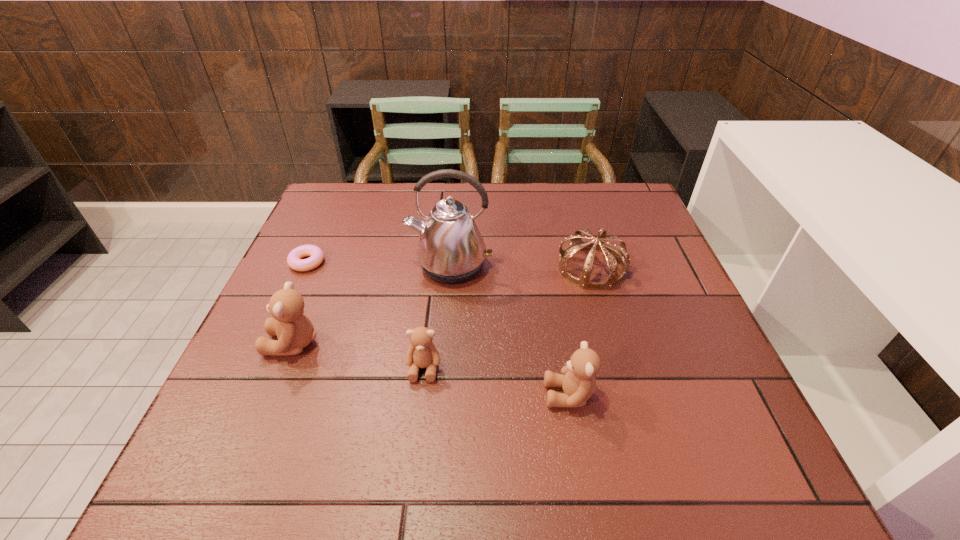
You are a GUI agent. You are given a task and a screenshot of the screen. Output one action in this format:
    pyautogui.click(x=<x>, y=<y>)
    Task: Click on the blank space at the near edge
    This screenshot has width=960, height=540.
    Given the screenshot: What is the action you would take?
    pyautogui.click(x=527, y=417)

In order to click on free space at the left edge in this screenshot , I will do `click(341, 246)`.

At what (x,y) coordinates should I click in order to perform the action: click on free space at the right edge of the desktop. Please return your answer as a coordinate pair (x, y). Image resolution: width=960 pixels, height=540 pixels. Looking at the image, I should click on tap(652, 315).

In the image, there is a desktop. Where is `free region at the far left corner`? free region at the far left corner is located at coordinates (360, 226).

Find the location of `blank space at the far right corner of the desktop`. blank space at the far right corner of the desktop is located at coordinates (631, 208).

Identify the location of free spot between the second shortest teddy bear and the kettle. The width and height of the screenshot is (960, 540). (510, 330).

Find the location of `vacant area between the tallest object and the second shortest teddy bear`. vacant area between the tallest object and the second shortest teddy bear is located at coordinates (510, 330).

The image size is (960, 540). In order to click on empty location between the shortest object and the tallest object in this screenshot , I will do `click(378, 264)`.

At what (x,y) coordinates should I click in order to perform the action: click on vacant space that is in between the tiara and the tallest object. Please return your answer as a coordinate pair (x, y). The height and width of the screenshot is (540, 960). Looking at the image, I should click on (520, 267).

You are a GUI agent. You are given a task and a screenshot of the screen. Output one action in this format:
    pyautogui.click(x=<x>, y=<y>)
    Task: Click on the unoccupied area between the leftmost teddy bear and the tiara
    
    Given the screenshot: What is the action you would take?
    pyautogui.click(x=442, y=306)